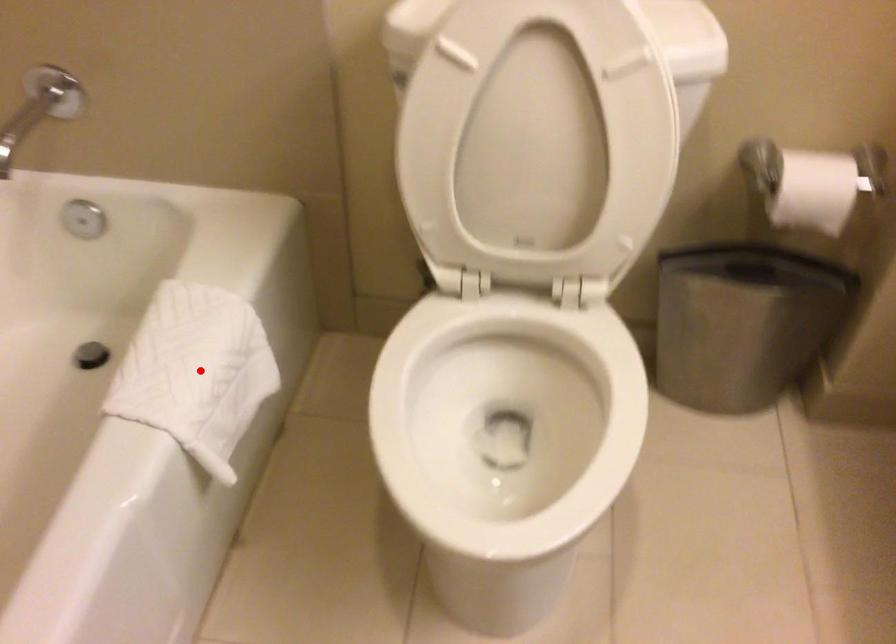
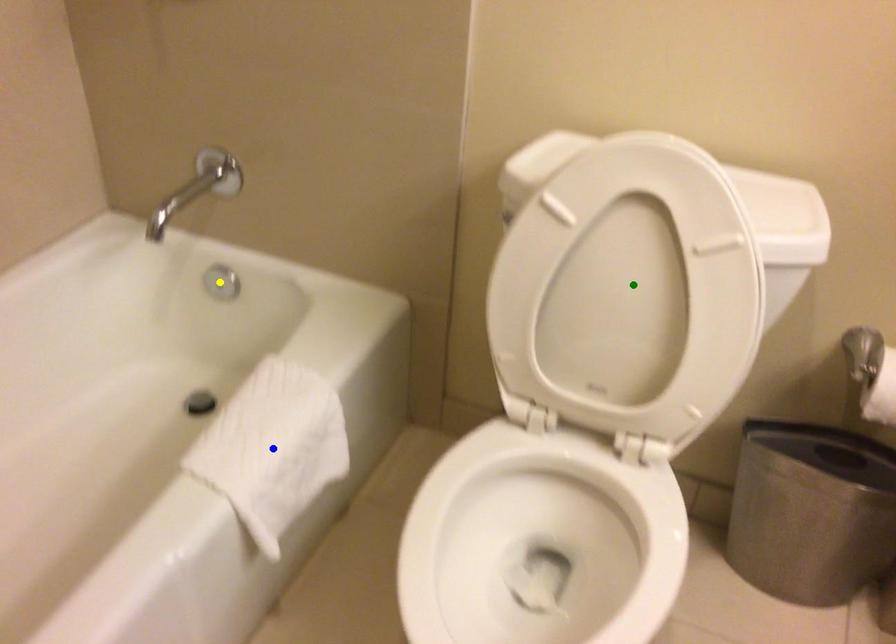
Question: I am providing you with two images of the same scene from different viewpoints. A red point is marked on the first image. You are given multiple points on the second image. Which mark in image 2 goes with the point in image 1?

Choices:
 (A) blue point
 (B) yellow point
 (C) green point

Answer: (A)